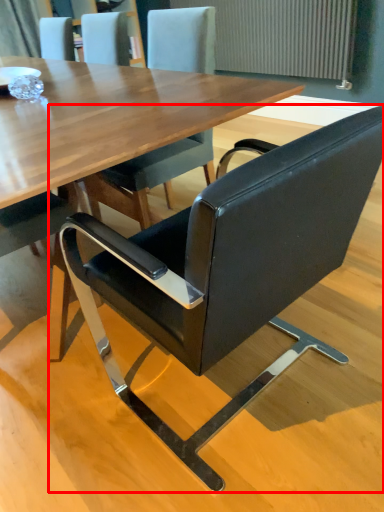
Question: From the image's perspective, what is the correct spatial positioning of chair (annotated by the red box) in reference to radiator?

Choices:
 (A) below
 (B) above

Answer: (A)